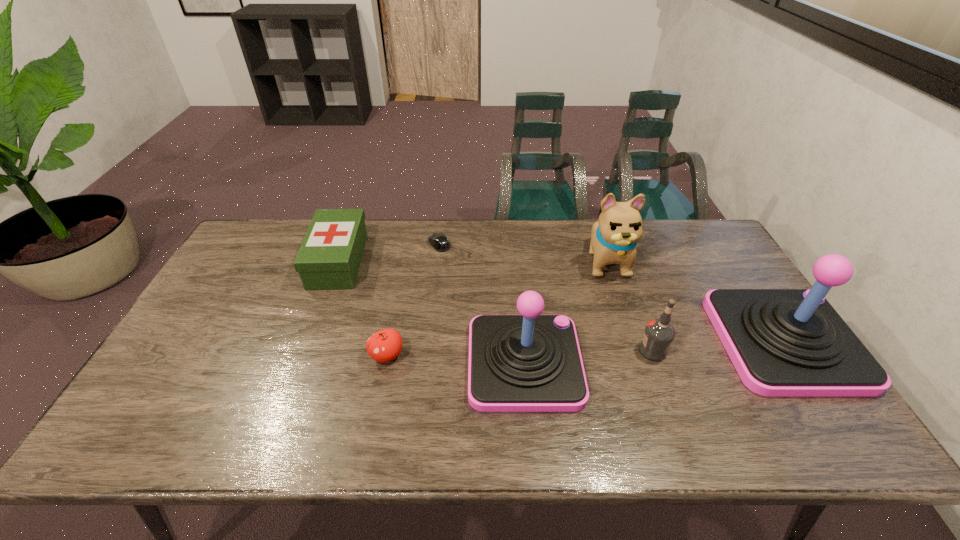
The joysticks are evenly distributed in the image. To maintain this, where would you place another joystick on the left? Please point to a free space. Please provide its 2D coordinates. Your answer should be formatted as a tuple, i.e. [(x, y)], where the tuple contains the x and y coordinates of a point satisfying the conditions above.

[(240, 385)]